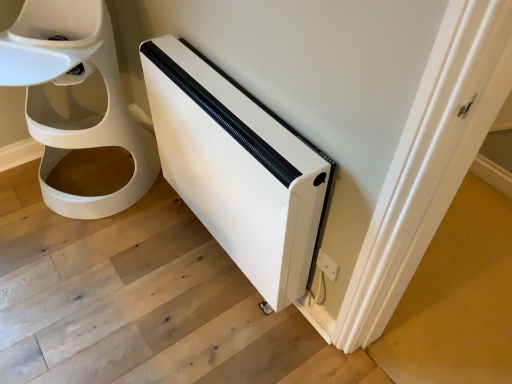
Question: Is white plastic electric outlet at lower right bigger or smaller than white matte heater at lower right?

Choices:
 (A) big
 (B) small

Answer: (B)

Question: In the image, is white plastic electric outlet at lower right positioned in front of or behind white matte heater at lower right?

Choices:
 (A) front
 (B) behind

Answer: (B)

Question: Which is farther from the white matte heater at lower right?

Choices:
 (A) white plastic electric outlet at lower right
 (B) white matte heater at lower right

Answer: (B)

Question: Which object is positioned closest to the white matte heater at lower right?

Choices:
 (A) white matte heater at lower right
 (B) white plastic electric outlet at lower right

Answer: (B)